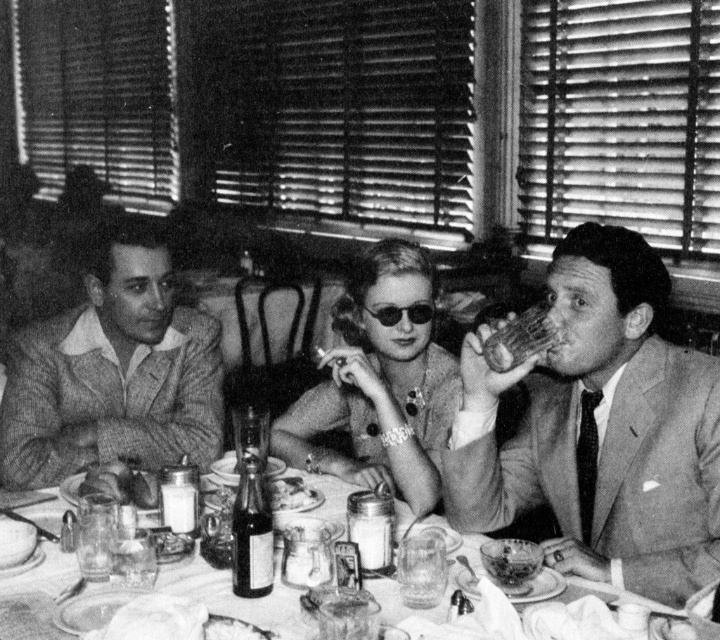
In the scene shown: Does smooth leather jacket at right have a larger size compared to smooth glass plate at center?

Yes, smooth leather jacket at right is bigger than smooth glass plate at center.

Which is below, smooth leather jacket at right or smooth glass plate at center?

smooth glass plate at center is lower down.

Is point (636, 532) less distant than point (220, 582)?

No.

You are a GUI agent. You are given a task and a screenshot of the screen. Output one action in this format:
    pyautogui.click(x=<x>, y=<y>)
    Task: Click on the smooth leather jacket at right
    
    Given the screenshot: What is the action you would take?
    pyautogui.click(x=598, y=429)

Between matte glass cigarette at center and smooth glass plate at center, which one appears on the right side from the viewer's perspective?

matte glass cigarette at center

Can you confirm if matte glass cigarette at center is positioned below smooth glass plate at center?

Actually, matte glass cigarette at center is above smooth glass plate at center.

The image size is (720, 640). In order to click on matte glass cigarette at center in this screenshot , I will do `click(379, 385)`.

Does smooth leather jacket at right have a larger size compared to smooth brown bread at center?

Yes.

In the scene shown: Is smooth leather jacket at right below smooth brown bread at center?

No.

Which is behind, point (546, 481) or point (132, 499)?

The point (546, 481) is more distant.

Locate an element on the screen. The image size is (720, 640). smooth leather jacket at right is located at coordinates (598, 429).